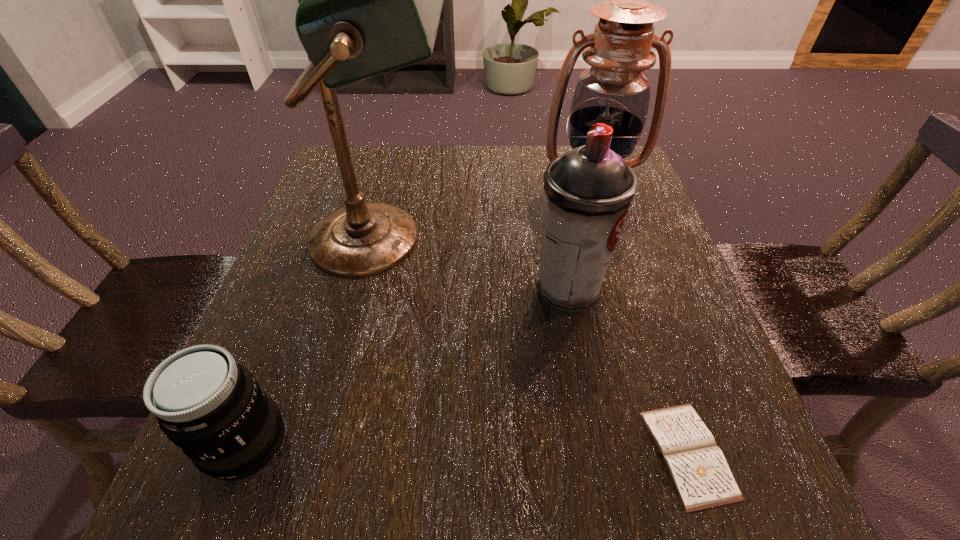
Where is `the tallest object`? Image resolution: width=960 pixels, height=540 pixels. the tallest object is located at coordinates (371, 3).

You are a GUI agent. You are given a task and a screenshot of the screen. Output one action in this format:
    pyautogui.click(x=<x>, y=<y>)
    Task: Click on the oil lamp
    
    Given the screenshot: What is the action you would take?
    pyautogui.click(x=613, y=91)

I want to click on aerosol can, so click(587, 192).

You are a GUI agent. You are given a task and a screenshot of the screen. Output one action in this format:
    pyautogui.click(x=<x>, y=<y>)
    Task: Click on the telephoto lens
    Image resolution: width=960 pixels, height=540 pixels.
    Given the screenshot: What is the action you would take?
    pyautogui.click(x=212, y=407)

The width and height of the screenshot is (960, 540). I want to click on diary, so click(697, 467).

Identify the location of vacant space situated above the green lampshade of the tallest object. Image resolution: width=960 pixels, height=540 pixels. (500, 239).

Find the location of a particular element. free space located 0.080m on the front of the oil lamp is located at coordinates (606, 234).

Identify the location of free spot located on the front of the third shortest object. (580, 350).

I want to click on vacant space located 0.210m on the back of the second shortest object, so click(299, 300).

The image size is (960, 540). Identify the location of vacant region located 0.160m on the left of the diary. (537, 454).